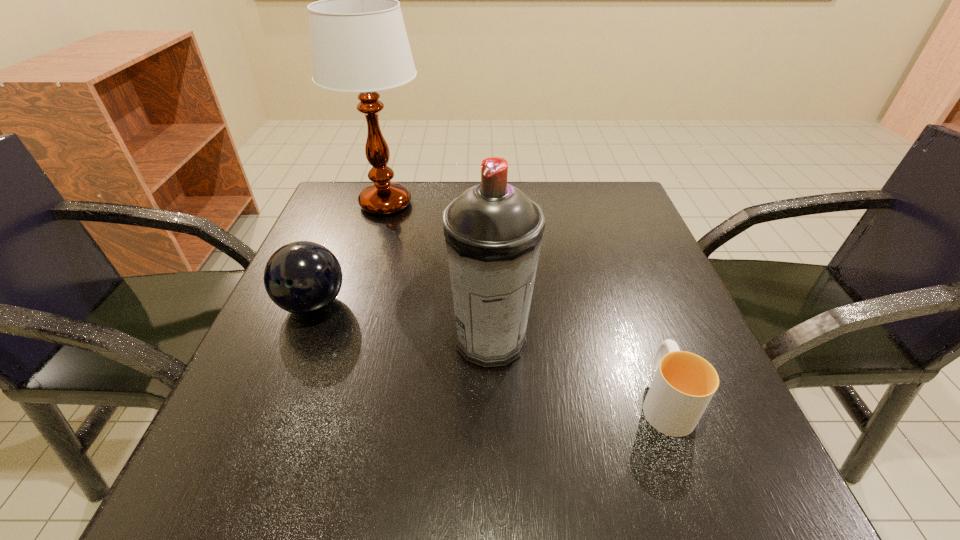
The width and height of the screenshot is (960, 540). I want to click on the farthest object, so click(x=359, y=43).

Find the location of `table lamp`. table lamp is located at coordinates (359, 43).

I want to click on the third shortest object, so click(493, 231).

Find the location of a particular element. The height and width of the screenshot is (540, 960). aerosol can is located at coordinates (493, 231).

Locate an element on the screen. The image size is (960, 540). bowling ball is located at coordinates (302, 277).

The image size is (960, 540). What are the coordinates of `the shortest object` in the screenshot? It's located at (684, 383).

Where is `cup`? The width and height of the screenshot is (960, 540). cup is located at coordinates (684, 383).

Locate an element on the screen. This screenshot has width=960, height=540. free location located 0.070m on the right of the table lamp is located at coordinates (456, 204).

Identify the location of free region located 0.110m on the right of the second tallest object. (596, 340).

Where is `free location located 0.270m on the side of the second shortest object with the finger holes`? This screenshot has width=960, height=540. free location located 0.270m on the side of the second shortest object with the finger holes is located at coordinates (239, 487).